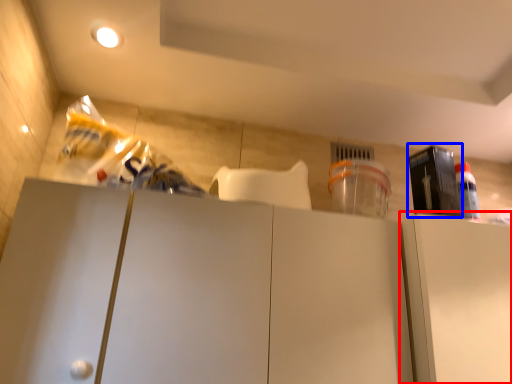
Question: Which object appears farthest to the camera in this image, cabinetry (highlighted by a red box) or appliance (highlighted by a blue box)?

Choices:
 (A) cabinetry
 (B) appliance

Answer: (B)